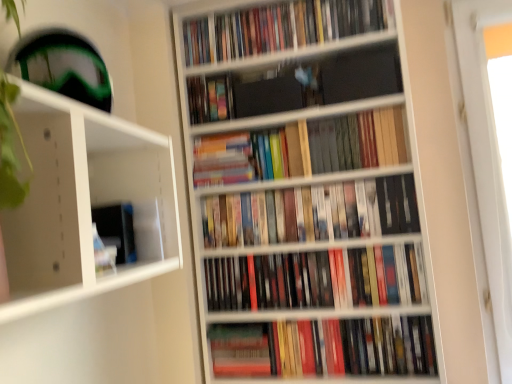
Question: Can you confirm if multicolored hardcover books at center, arranged as the 6th book when ordered from the bottom, is thinner than wooden bookshelf at center?

Choices:
 (A) no
 (B) yes

Answer: (B)

Question: Does multicolored hardcover books at center, arranged as the 6th book when ordered from the bottom, appear on the left side of wooden bookshelf at center?

Choices:
 (A) yes
 (B) no

Answer: (A)

Question: Is multicolored hardcover books at center, arranged as the 6th book when ordered from the bottom, wider than wooden bookshelf at center?

Choices:
 (A) no
 (B) yes

Answer: (A)

Question: Does multicolored hardcover books at center, the second book when ordered from top to bottom, come in front of wooden bookshelf at center?

Choices:
 (A) yes
 (B) no

Answer: (B)

Question: From a real-world perspective, is multicolored hardcover books at center, arranged as the 6th book when ordered from the bottom, under wooden bookshelf at center?

Choices:
 (A) no
 (B) yes

Answer: (A)

Question: Would you say hardcover books at center, the 2th book positioned from the bottom, is inside or outside hardcover books at upper center, placed as the seventh book when sorted from bottom to top?

Choices:
 (A) inside
 (B) outside

Answer: (B)

Question: Visually, is hardcover books at center, the 2th book positioned from the bottom, positioned to the left or to the right of hardcover books at upper center, placed as the seventh book when sorted from bottom to top?

Choices:
 (A) right
 (B) left

Answer: (A)

Question: From the image's perspective, is hardcover books at center, the 2th book positioned from the bottom, above or below hardcover books at upper center, positioned as the first book in top-to-bottom order?

Choices:
 (A) above
 (B) below

Answer: (B)

Question: From their relative heights in the image, would you say hardcover books at center, the 2th book positioned from the bottom, is taller or shorter than hardcover books at upper center, placed as the seventh book when sorted from bottom to top?

Choices:
 (A) short
 (B) tall

Answer: (B)

Question: Considering the positions of hardcover books at upper center, placed as the seventh book when sorted from bottom to top, and hardcover book at center, which is the seventh book in top-to-bottom order, in the image, is hardcover books at upper center, placed as the seventh book when sorted from bottom to top, taller or shorter than hardcover book at center, which is the seventh book in top-to-bottom order,?

Choices:
 (A) tall
 (B) short

Answer: (B)

Question: From a real-world perspective, is hardcover books at upper center, positioned as the first book in top-to-bottom order, above or below hardcover book at center, which appears as the 1th book when ordered from the bottom?

Choices:
 (A) above
 (B) below

Answer: (A)

Question: Would you say hardcover books at upper center, positioned as the first book in top-to-bottom order, is to the left or to the right of hardcover book at center, which is the seventh book in top-to-bottom order, in the picture?

Choices:
 (A) right
 (B) left

Answer: (B)

Question: Is hardcover books at upper center, positioned as the first book in top-to-bottom order, in front of or behind hardcover book at center, which appears as the 1th book when ordered from the bottom, in the image?

Choices:
 (A) behind
 (B) front

Answer: (A)

Question: Looking at the image, does multicolored hardcover books at center, arranged as the 6th book when ordered from the bottom, seem bigger or smaller compared to hardcover books at center, marked as the 6th book in a top-to-bottom arrangement?

Choices:
 (A) small
 (B) big

Answer: (A)

Question: Considering their positions, is multicolored hardcover books at center, the second book when ordered from top to bottom, located in front of or behind hardcover books at center, marked as the 6th book in a top-to-bottom arrangement?

Choices:
 (A) behind
 (B) front

Answer: (A)